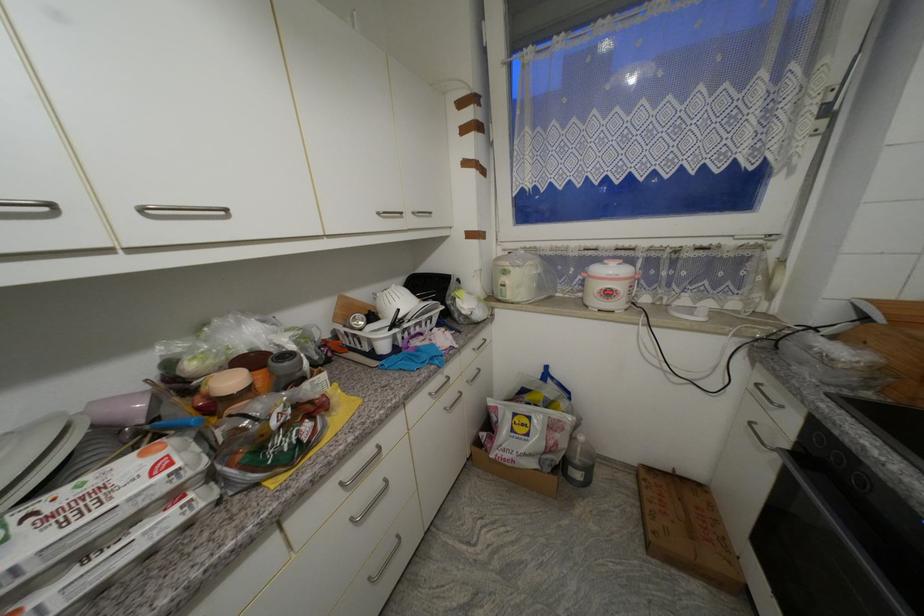
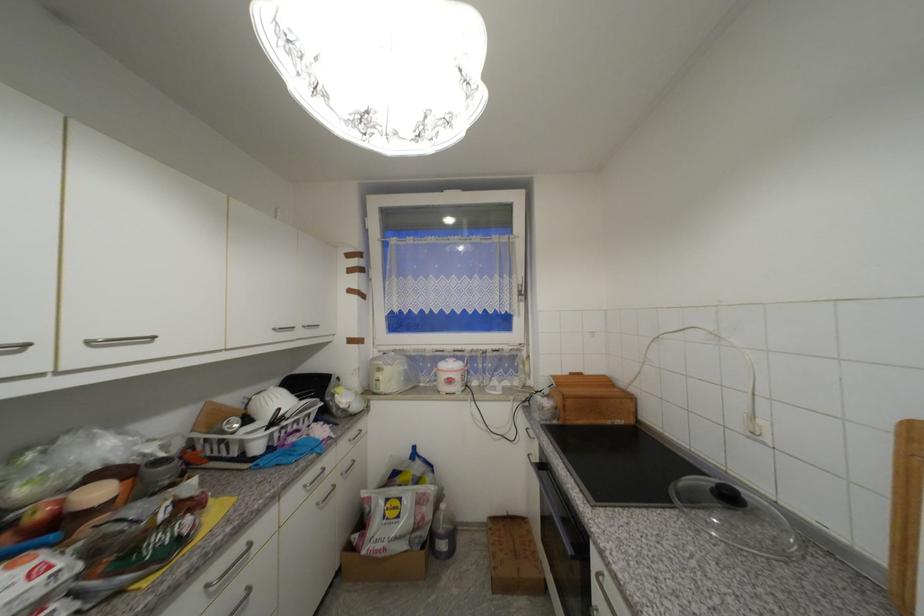
In the second image, find the point that corresponds to pixel 451 410 in the first image.

(322, 505)